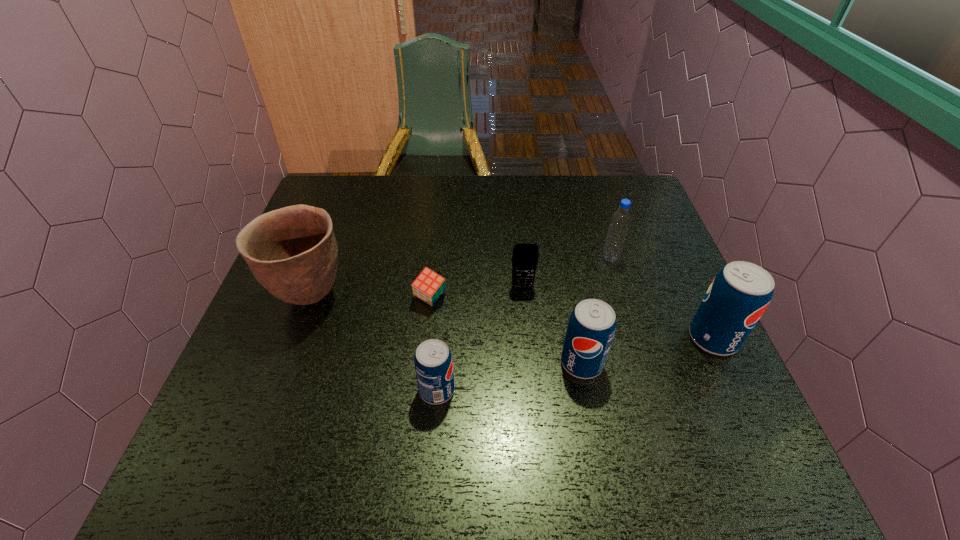
Locate an element on the screen. This screenshot has height=540, width=960. water bottle positioned at the right edge is located at coordinates (620, 221).

Where is `vacant space at the far edge of the desktop`? This screenshot has height=540, width=960. vacant space at the far edge of the desktop is located at coordinates (523, 190).

Find the location of a particular element. This screenshot has width=960, height=540. free space at the near edge of the desktop is located at coordinates (363, 422).

Find the location of `vacant space at the left edge`. vacant space at the left edge is located at coordinates (322, 342).

You are a GUI agent. You are given a task and a screenshot of the screen. Output one action in this format:
    pyautogui.click(x=<x>, y=<y>)
    Task: Click on the free region at the right edge of the desktop
    Image resolution: width=960 pixels, height=540 pixels.
    Given the screenshot: What is the action you would take?
    pyautogui.click(x=647, y=227)

What are the coordinates of `vacant area at the far right corner of the desktop` in the screenshot? It's located at coord(597,200).

The width and height of the screenshot is (960, 540). Find the location of `free area in between the fourth object from left to right and the second pop from left to right`. free area in between the fourth object from left to right and the second pop from left to right is located at coordinates tap(552, 325).

You are a GUI agent. You are given a task and a screenshot of the screen. Output one action in this format:
    pyautogui.click(x=<x>, y=<y>)
    Task: Click on the vacant point located between the fifth object from left to right and the fourth object from left to right
    This screenshot has height=540, width=960.
    Given the screenshot: What is the action you would take?
    pyautogui.click(x=552, y=325)

Identify the location of free space between the cellular telephone and the rightmost pop. The image size is (960, 540). (617, 313).

Image resolution: width=960 pixels, height=540 pixels. I want to click on empty space between the rightmost object and the farthest object, so click(x=661, y=298).